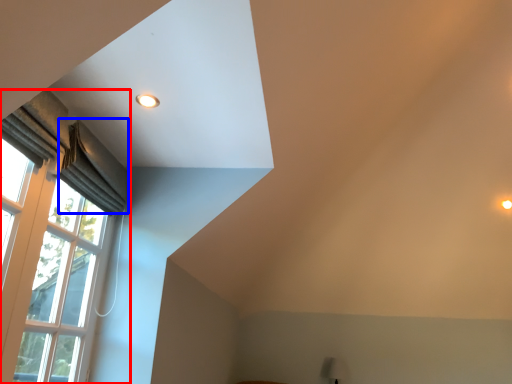
Question: Which of the following is the closest to the observer, window (highlighted by a red box) or curtain (highlighted by a blue box)?

Choices:
 (A) window
 (B) curtain

Answer: (A)